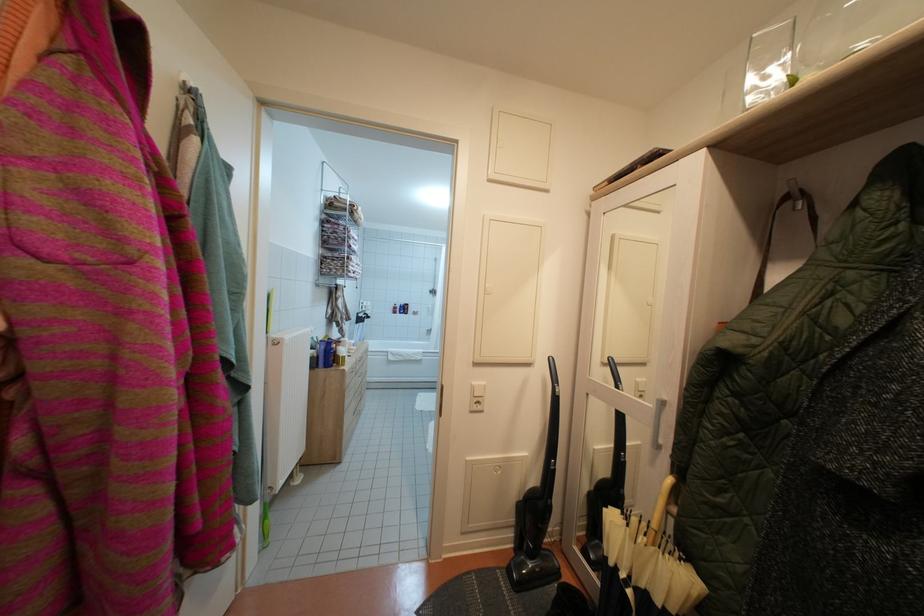
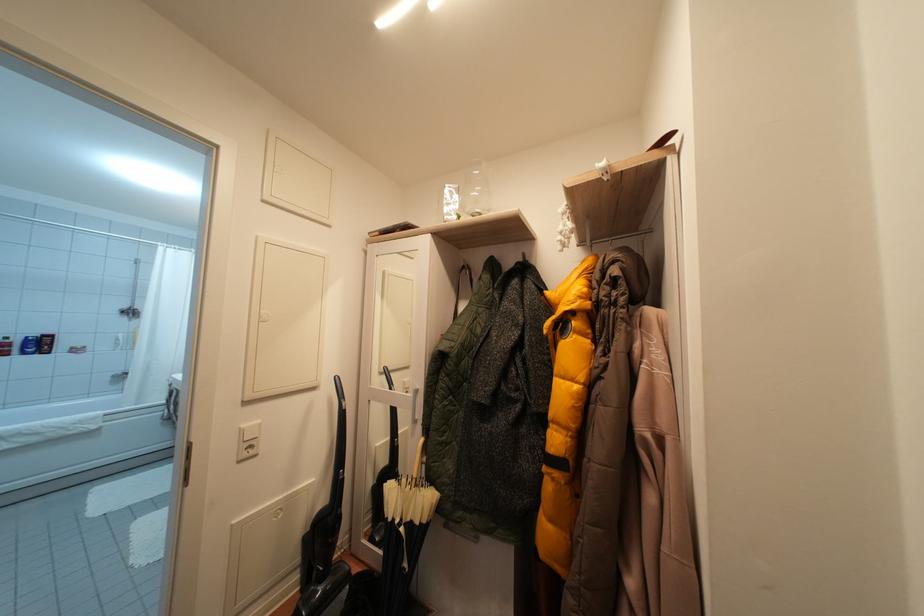
The point at (808, 65) is marked in the first image. Where is the corresponding point in the second image?

(468, 212)